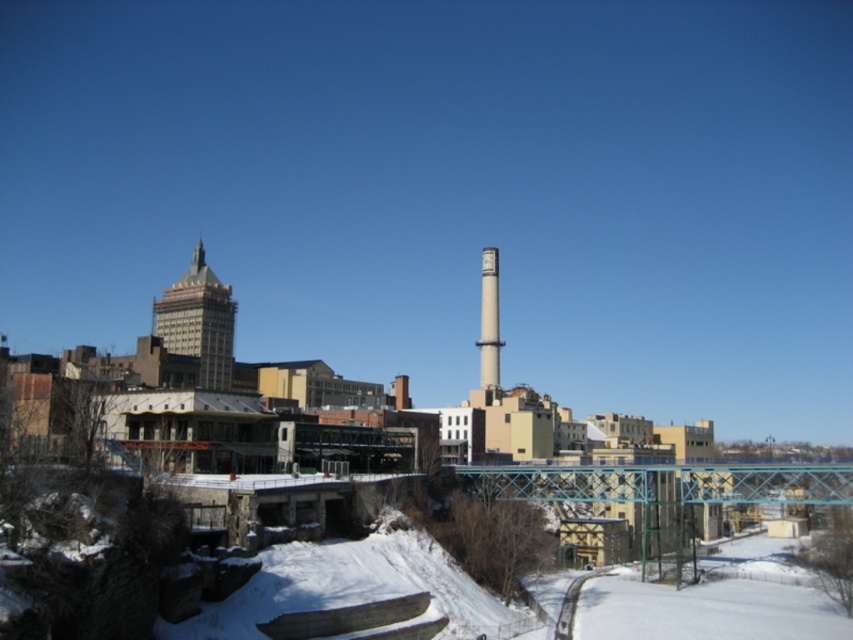
Question: Is gold textured building at upper left further to camera compared to smooth concrete tower at center?

Choices:
 (A) no
 (B) yes

Answer: (B)

Question: Which point is closer to the camera taking this photo?

Choices:
 (A) (490, 336)
 (B) (183, 278)

Answer: (A)

Question: Is the position of gold textured building at upper left more distant than that of smooth concrete tower at center?

Choices:
 (A) yes
 (B) no

Answer: (A)

Question: Can you confirm if gold textured building at upper left is wider than smooth concrete tower at center?

Choices:
 (A) no
 (B) yes

Answer: (B)

Question: Among these objects, which one is nearest to the camera?

Choices:
 (A) smooth concrete tower at center
 (B) gold textured building at upper left

Answer: (A)

Question: Which of the following is the farthest from the observer?

Choices:
 (A) click(x=486, y=348)
 (B) click(x=196, y=332)

Answer: (B)